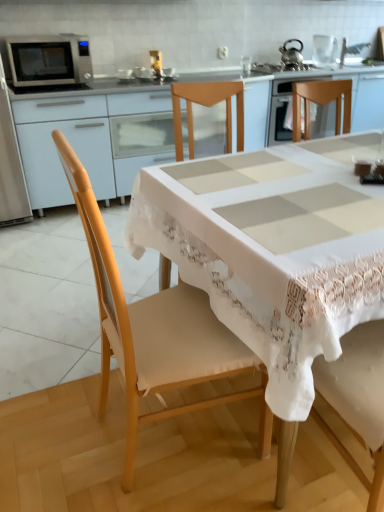
Question: Considering the relative sizes of wooden chair at center and clear glass kettle at upper center, the first appliance when ordered from back to front, in the image provided, is wooden chair at center smaller than clear glass kettle at upper center, the first appliance when ordered from back to front,?

Choices:
 (A) yes
 (B) no

Answer: (B)

Question: Does wooden chair at center have a lesser width compared to clear glass kettle at upper center, the second appliance from the front?

Choices:
 (A) no
 (B) yes

Answer: (A)

Question: From the image's perspective, is wooden chair at center on top of clear glass kettle at upper center, marked as the second appliance in a left-to-right arrangement?

Choices:
 (A) yes
 (B) no

Answer: (B)

Question: Does wooden chair at center have a greater width compared to clear glass kettle at upper center, marked as the second appliance in a left-to-right arrangement?

Choices:
 (A) no
 (B) yes

Answer: (B)

Question: From a real-world perspective, is wooden chair at center physically above clear glass kettle at upper center, the second appliance from the front?

Choices:
 (A) yes
 (B) no

Answer: (B)

Question: Is point (322, 58) closer or farther from the camera than point (62, 197)?

Choices:
 (A) farther
 (B) closer

Answer: (A)

Question: Based on their sizes in the image, would you say clear glass kettle at upper center, the second appliance positioned from the bottom, is bigger or smaller than matte white cabinet at upper left?

Choices:
 (A) big
 (B) small

Answer: (B)

Question: In the image, is clear glass kettle at upper center, the second appliance positioned from the bottom, positioned in front of or behind matte white cabinet at upper left?

Choices:
 (A) behind
 (B) front

Answer: (A)

Question: From a real-world perspective, is clear glass kettle at upper center, marked as the second appliance in a left-to-right arrangement, above or below matte white cabinet at upper left?

Choices:
 (A) above
 (B) below

Answer: (A)

Question: In terms of width, does matte white cabinet at upper left look wider or thinner when compared to wooden chair at center?

Choices:
 (A) thin
 (B) wide

Answer: (B)

Question: From their relative heights in the image, would you say matte white cabinet at upper left is taller or shorter than wooden chair at center?

Choices:
 (A) tall
 (B) short

Answer: (B)

Question: Is matte white cabinet at upper left inside the boundaries of wooden chair at center, or outside?

Choices:
 (A) inside
 (B) outside

Answer: (B)

Question: Is matte white cabinet at upper left in front of or behind wooden chair at center in the image?

Choices:
 (A) front
 (B) behind

Answer: (B)

Question: Looking at the image, does white ceramic sink at upper center seem bigger or smaller compared to wooden chair at center?

Choices:
 (A) small
 (B) big

Answer: (A)

Question: Considering their positions, is white ceramic sink at upper center located in front of or behind wooden chair at center?

Choices:
 (A) front
 (B) behind

Answer: (B)